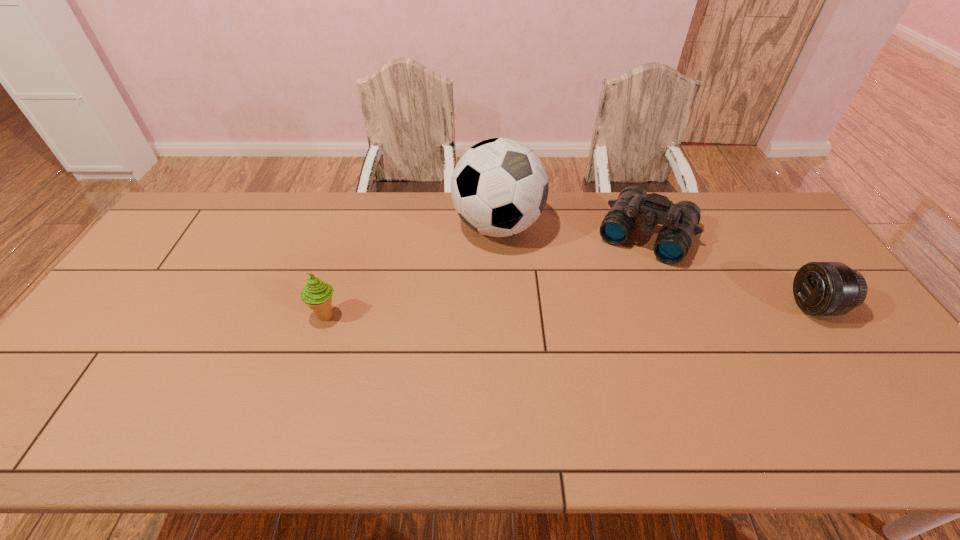
Image resolution: width=960 pixels, height=540 pixels. I want to click on icecream, so click(x=316, y=294).

Locate an element on the screen. This screenshot has height=540, width=960. telephoto lens is located at coordinates (820, 288).

Find the location of a particular element. This screenshot has height=540, width=960. the third object from left to right is located at coordinates (679, 221).

Locate an element on the screen. the tallest object is located at coordinates (499, 187).

Image resolution: width=960 pixels, height=540 pixels. Find the location of `soccer ball`. soccer ball is located at coordinates (499, 187).

Image resolution: width=960 pixels, height=540 pixels. In order to click on free spot located on the front of the leftmost object in this screenshot , I will do `click(318, 342)`.

Identify the location of vacant space located on the front-facing side of the rightmost object. This screenshot has width=960, height=540. (729, 306).

The height and width of the screenshot is (540, 960). In order to click on free region located on the front-facing side of the rightmost object in this screenshot , I will do [735, 306].

This screenshot has width=960, height=540. What are the coordinates of `vacant space situated on the front-facing side of the rightmost object` in the screenshot? It's located at (707, 306).

Find the location of a particular element. free spot located 0.230m through the lenses of the second object from right to left is located at coordinates (606, 315).